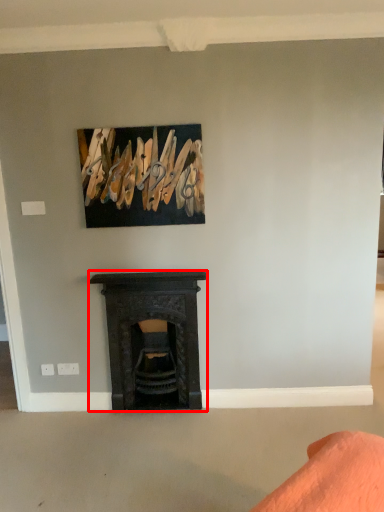
Question: From the image's perspective, where is fireplace (annotated by the red box) located relative to picture frame?

Choices:
 (A) above
 (B) below

Answer: (B)